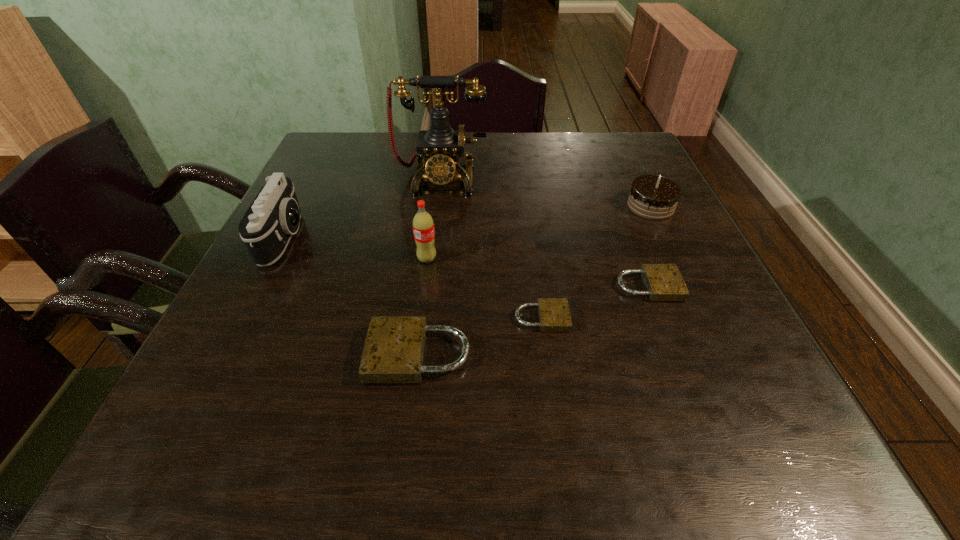
Locate an element on the screen. vacant space situated on the keyhole side of the tallest padlock is located at coordinates (317, 355).

The image size is (960, 540). Find the location of `free space located 0.090m on the keyhole side of the tallest padlock`. free space located 0.090m on the keyhole side of the tallest padlock is located at coordinates (317, 355).

Where is `blank area located 0.070m on the keyhole side of the tallest padlock`? blank area located 0.070m on the keyhole side of the tallest padlock is located at coordinates (328, 355).

Where is `blank space located 0.200m on the keyhole side of the fifth object from left to right`? The height and width of the screenshot is (540, 960). blank space located 0.200m on the keyhole side of the fifth object from left to right is located at coordinates (676, 318).

You are a GUI agent. You are given a task and a screenshot of the screen. Output one action in this format:
    pyautogui.click(x=<x>, y=<y>)
    Task: Click on the free location located 0.050m on the keyhole side of the second tallest padlock
    This screenshot has height=540, width=960.
    Given the screenshot: What is the action you would take?
    coord(704,286)

Image resolution: width=960 pixels, height=540 pixels. I want to click on vacant area situated on the front of the telephone, featuring the rotary dial, so click(x=434, y=234).

Locate an element on the screen. Image resolution: width=960 pixels, height=540 pixels. free space located 0.280m on the front lens of the camera is located at coordinates (429, 238).

I want to click on vacant space located 0.310m on the right of the soda, so click(x=582, y=259).

Find the location of a particular element. The height and width of the screenshot is (540, 960). vacant area situated on the back of the fourth tallest object is located at coordinates (627, 157).

At what (x,y) coordinates should I click in order to perform the action: click on object at the far edge. Please return your answer as a coordinate pair (x, y). Looking at the image, I should click on (439, 149).